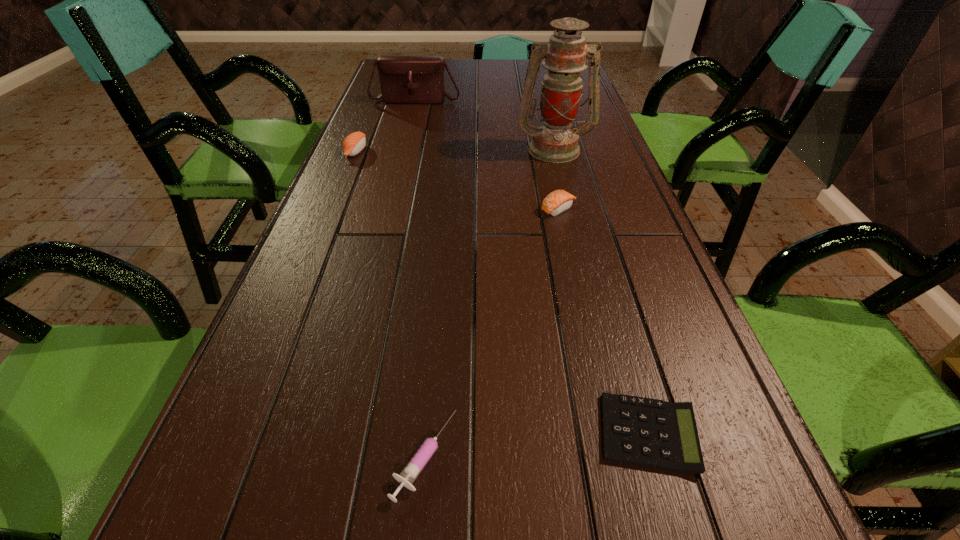
Find the location of a particular element. Image resolution: width=960 pixels, height=540 pixels. oil lamp is located at coordinates (555, 142).

This screenshot has width=960, height=540. In order to click on the fifth shortest object in this screenshot , I will do `click(404, 79)`.

I want to click on shoulder bag, so click(x=404, y=79).

Image resolution: width=960 pixels, height=540 pixels. I want to click on the taller sushi, so click(x=354, y=143).

Image resolution: width=960 pixels, height=540 pixels. What are the coordinates of `the left sushi` in the screenshot? It's located at (354, 143).

Where is `the right sushi`? The height and width of the screenshot is (540, 960). the right sushi is located at coordinates pos(558,201).

Image resolution: width=960 pixels, height=540 pixels. I want to click on the shorter sushi, so click(x=558, y=201).

The width and height of the screenshot is (960, 540). What are the coordinates of `syringe` in the screenshot? It's located at (414, 467).

I want to click on the shortest object, so click(645, 432).

Locate an element on the screen. free space located on the left of the oil lamp is located at coordinates (454, 149).